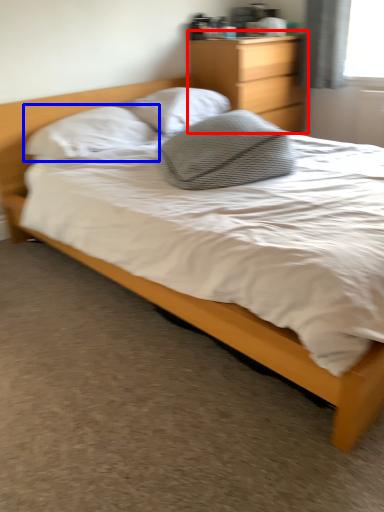
Question: Which point is further to the camera, nightstand (highlighted by a red box) or pillow (highlighted by a blue box)?

Choices:
 (A) nightstand
 (B) pillow

Answer: (A)